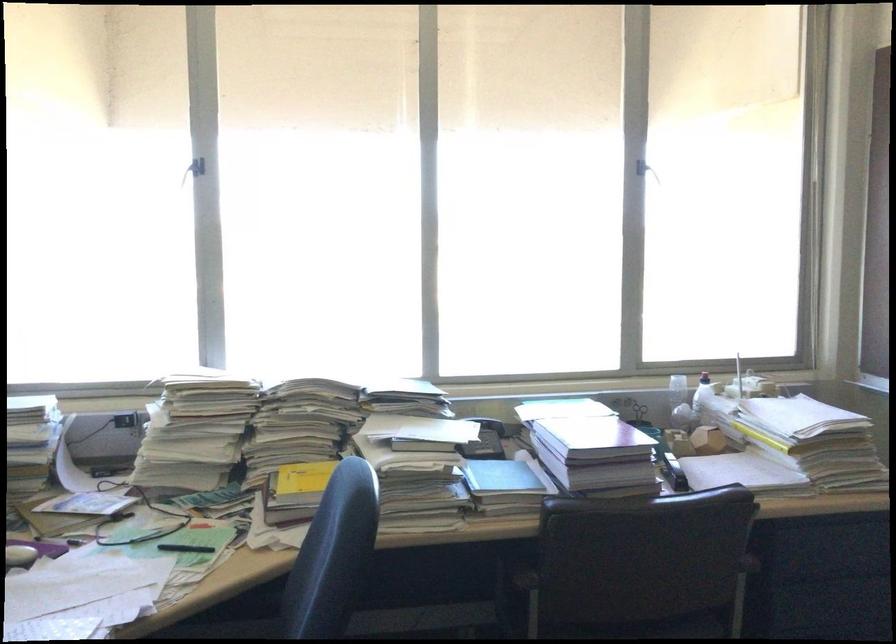
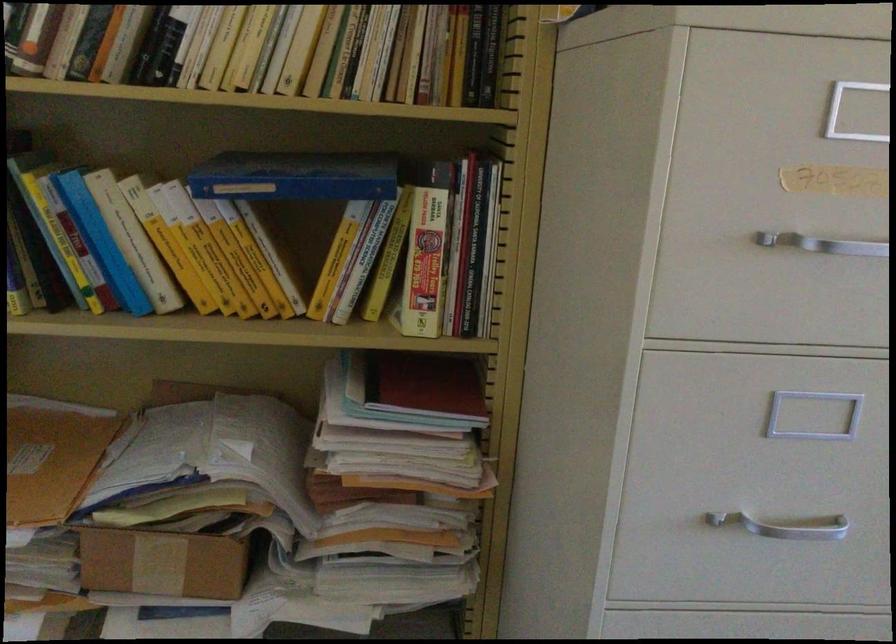
How did the camera likely rotate?

The camera rotated toward left-down.